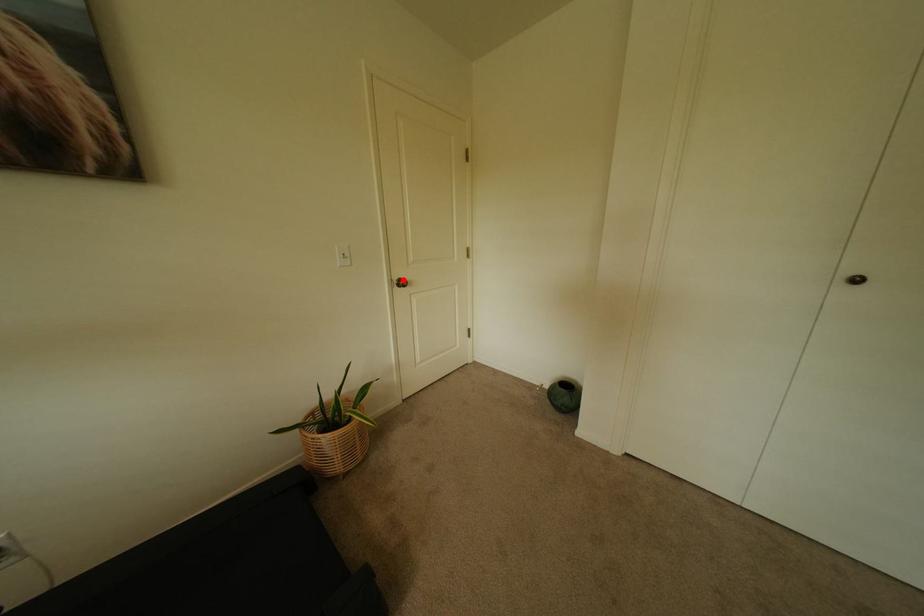
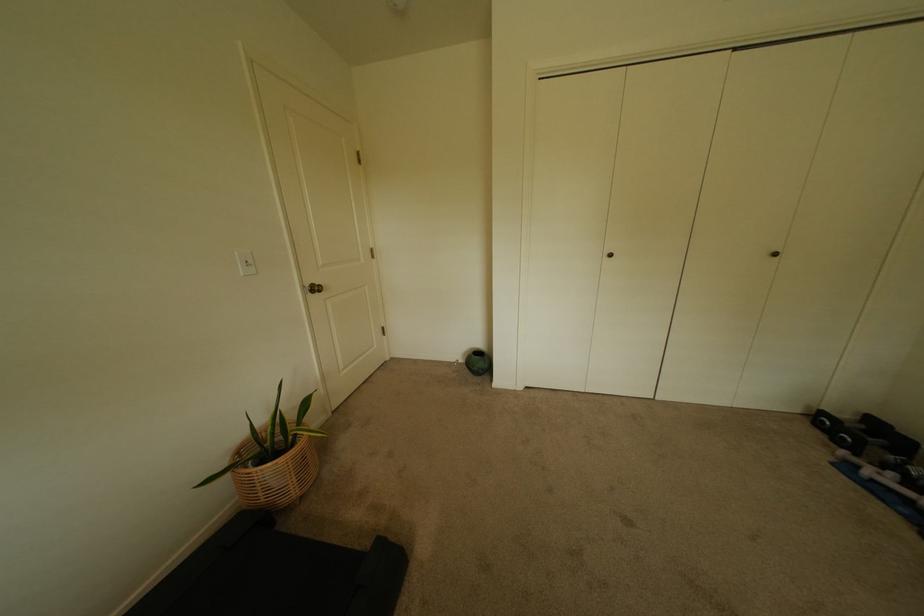
In the second image, find the point that corresponds to the highlighted location in the first image.

(315, 286)